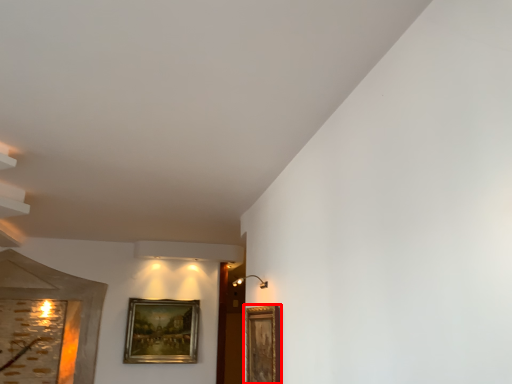
Question: From the image's perspective, where is picture frame (annotated by the red box) located relative to picture frame?

Choices:
 (A) above
 (B) below

Answer: (A)